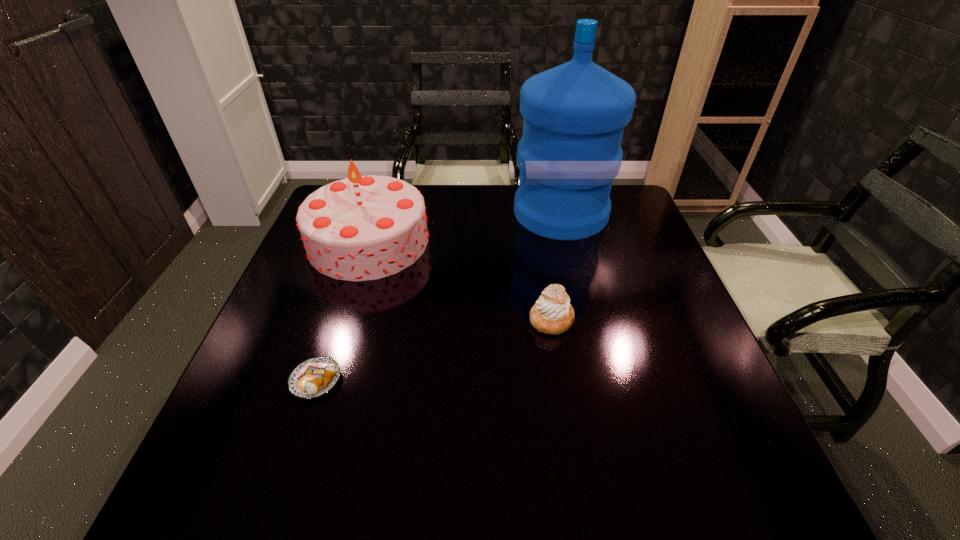
At what (x,y) coordinates should I click in order to perform the action: click on the tallest object. Please return your answer as a coordinate pair (x, y). Looking at the image, I should click on (570, 152).

At what (x,y) coordinates should I click in order to perform the action: click on the third shortest object. Please return your answer as a coordinate pair (x, y). Image resolution: width=960 pixels, height=540 pixels. Looking at the image, I should click on (360, 228).

The width and height of the screenshot is (960, 540). What are the coordinates of `the farther pastry` in the screenshot? It's located at (552, 313).

This screenshot has height=540, width=960. What are the coordinates of `the second shortest object` in the screenshot? It's located at (552, 313).

Locate an element on the screen. the nearer pastry is located at coordinates pyautogui.click(x=315, y=377).

The height and width of the screenshot is (540, 960). Find the location of `the nearest object`. the nearest object is located at coordinates (315, 377).

Identify the location of vacant area situated 0.050m on the front of the tallest object. The height and width of the screenshot is (540, 960). (570, 253).

The image size is (960, 540). Find the location of `free space located on the front of the birthday cake`. free space located on the front of the birthday cake is located at coordinates coord(351,299).

Find the location of a particular element. free region located on the right of the second shortest object is located at coordinates (677, 319).

The width and height of the screenshot is (960, 540). Find the location of `free space located on the right of the left pastry`. free space located on the right of the left pastry is located at coordinates coord(483,381).